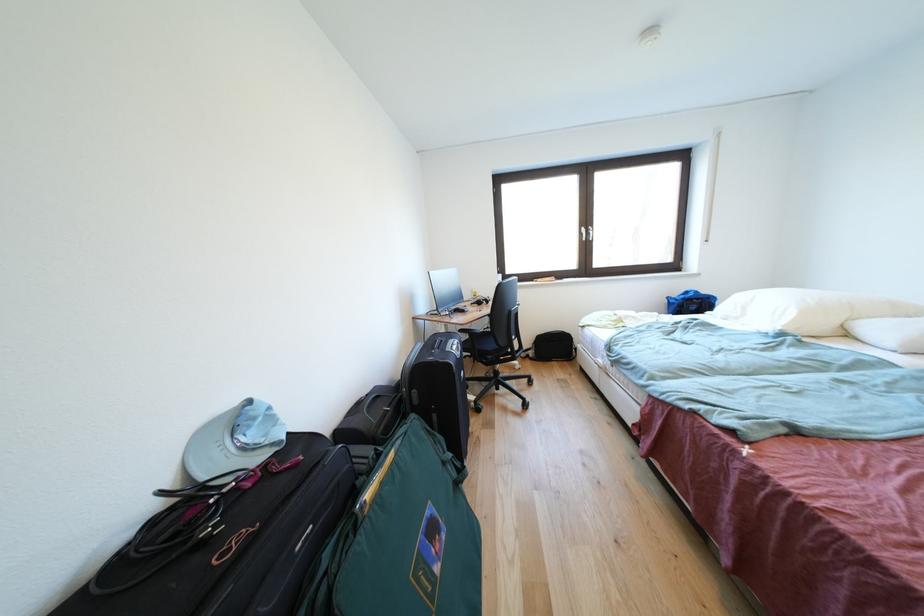
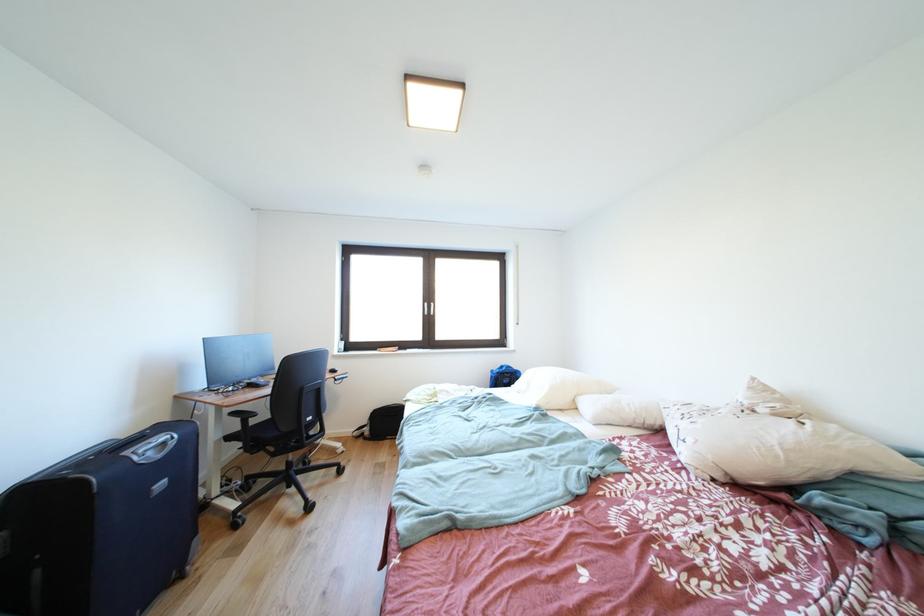
Question: What movement of the cameraman would produce the second image?

Choices:
 (A) Left
 (B) Right
 (C) Forward
 (D) Backward

Answer: (B)